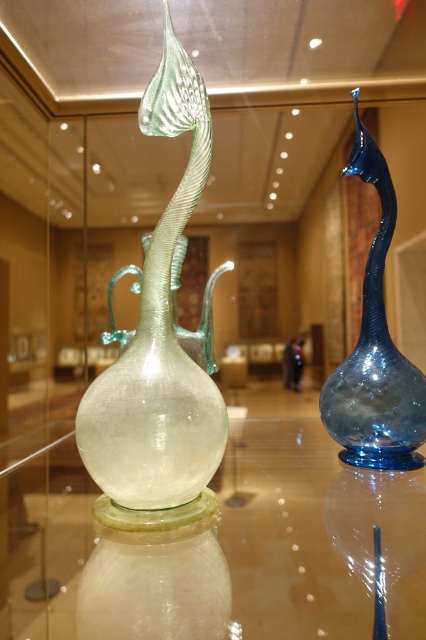
Does transparent glass table at center appear on the left side of transparent glass vase at center?

Incorrect, transparent glass table at center is not on the left side of transparent glass vase at center.

Can you confirm if transparent glass table at center is smaller than transparent glass vase at center?

Actually, transparent glass table at center might be larger than transparent glass vase at center.

Where is `transparent glass table at center`? The image size is (426, 640). transparent glass table at center is located at coordinates (316, 536).

Can you confirm if transparent glass table at center is taller than blue glass vase at right?

No.

Who is positioned more to the left, transparent glass table at center or blue glass vase at right?

From the viewer's perspective, transparent glass table at center appears more on the left side.

The image size is (426, 640). Identify the location of transparent glass table at center. (316, 536).

Between transparent glass vase at center and blue glass vase at right, which one has more height?

blue glass vase at right

Is transparent glass vase at center closer to camera compared to blue glass vase at right?

Yes, transparent glass vase at center is closer to the viewer.

Measure the distance between point (169, 284) and camera.

They are 20.53 inches apart.

Where is `transparent glass vase at center`? Image resolution: width=426 pixels, height=640 pixels. transparent glass vase at center is located at coordinates (158, 337).